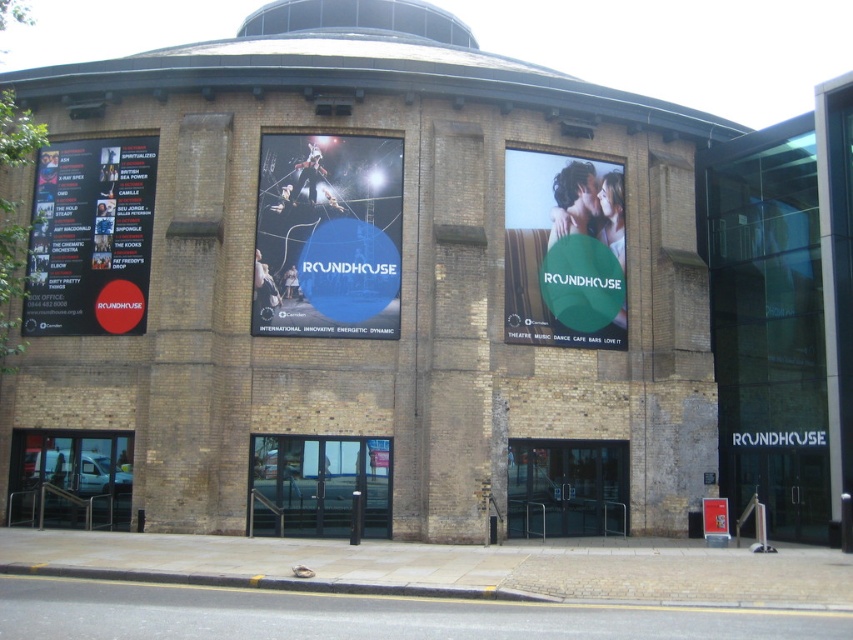
Question: Is black paper poster at left positioned behind matte green sign at center?

Choices:
 (A) yes
 (B) no

Answer: (B)

Question: Which point is closer to the camera?

Choices:
 (A) black paper poster at left
 (B) blue glossy poster at center

Answer: (B)

Question: Does blue glossy poster at center come behind black paper poster at left?

Choices:
 (A) yes
 (B) no

Answer: (B)

Question: Among these points, which one is nearest to the camera?

Choices:
 (A) (524, 221)
 (B) (252, 317)
 (C) (28, 268)

Answer: (B)

Question: Can you confirm if black paper poster at left is positioned below matte green sign at center?

Choices:
 (A) no
 (B) yes

Answer: (A)

Question: Which point is farther from the camera taking this photo?

Choices:
 (A) (579, 292)
 (B) (108, 209)
 (C) (386, 164)

Answer: (A)